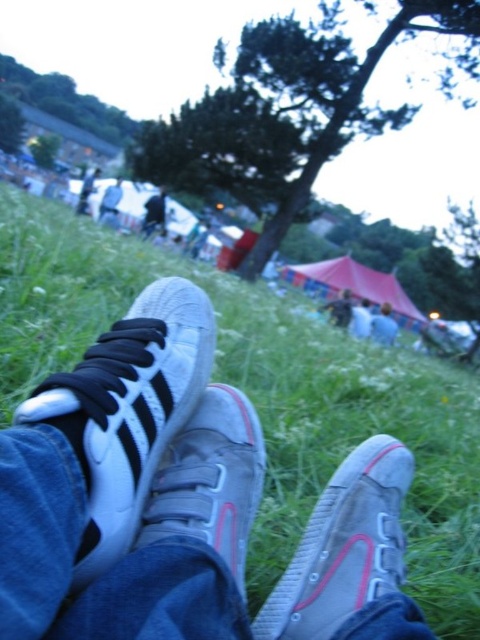
You are standing in the festival area and notice the blue denim jeans at lower center and the black leather jacket at upper center. Which item is positioned closer to the ground?

The blue denim jeans at lower center is positioned closer to the ground since it has a lesser height compared to the black leather jacket at upper center.

You are a photographer setting up a tripod to capture the scene. The tripod requires a minimum of 12 feet of space between the gray canvas shoe at lower right and the blue denim jeans at lower center to ensure stability. Is the current distance sufficient?

The gray canvas shoe at lower right and blue denim jeans at lower center are 15.65 feet apart, which exceeds the required 12 feet. Therefore, the distance is sufficient for the tripod setup.

You are standing at the red tent and want to take a photo of both the point at coordinates point [441,512] and point [388,314]. Which point should you focus on first to ensure both are in focus?

You should focus on point [388,314] first because it is farther away from the camera than point [441,512]. By focusing on the farther point, the closer point will also be within the depth of field.